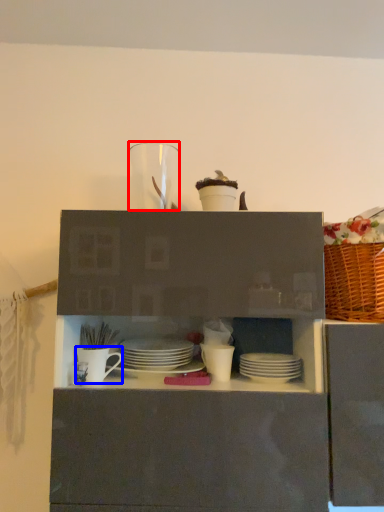
Question: Which point is further to the camera, tableware (highlighted by a red box) or tableware (highlighted by a blue box)?

Choices:
 (A) tableware
 (B) tableware

Answer: (A)